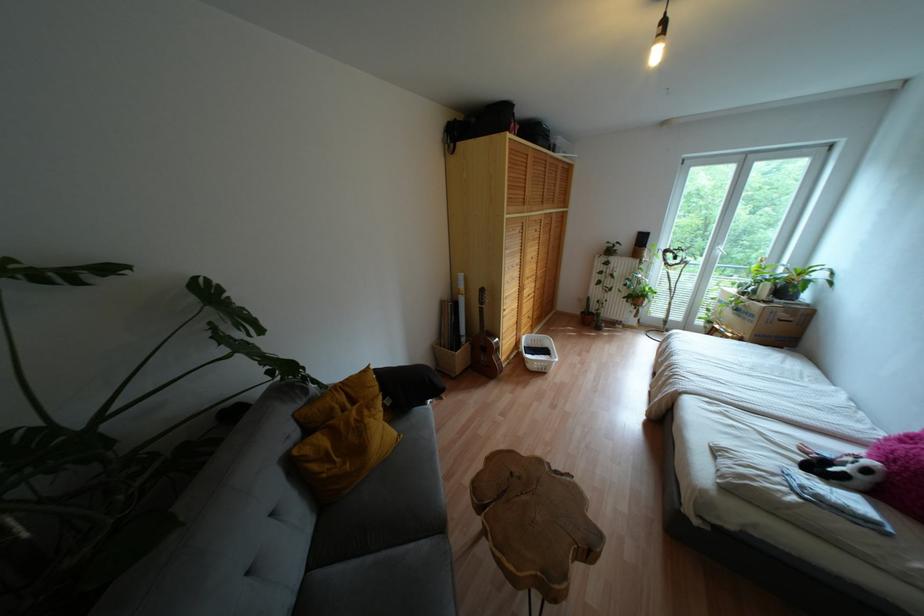
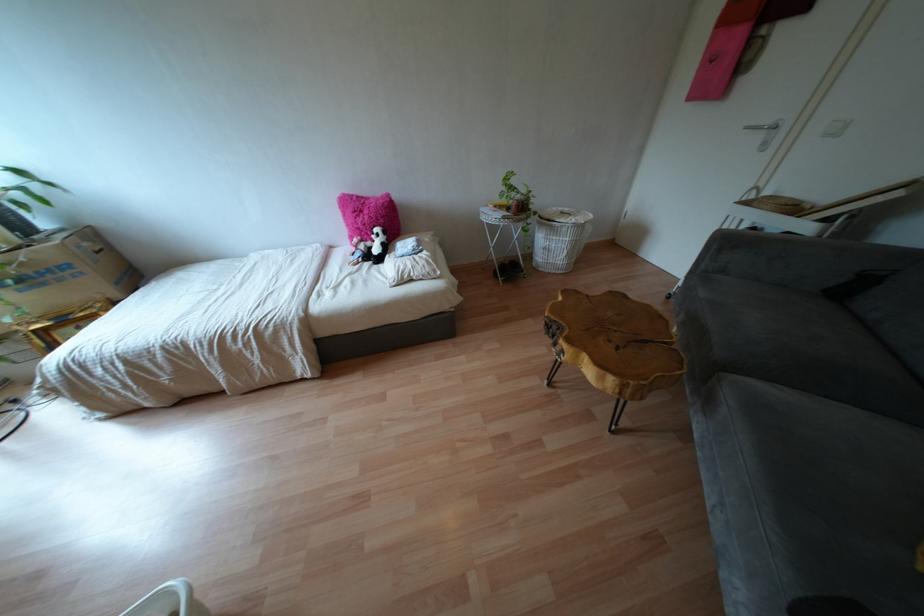
Where in the second image is the point corresponding to the point at 760,434 from the first image?

(349, 274)